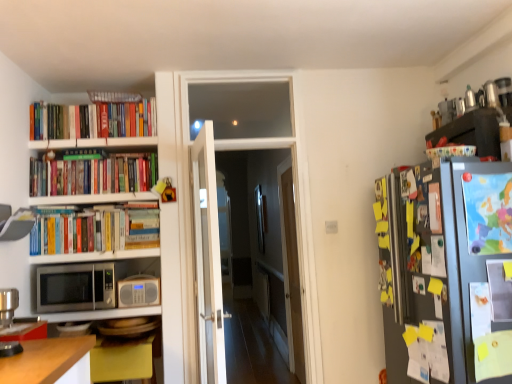
Image resolution: width=512 pixels, height=384 pixels. In order to click on blank space situated above hardcover books at upper left, acting as the 2th book starting from the top (from a real-world perspective) in this screenshot , I will do `click(89, 146)`.